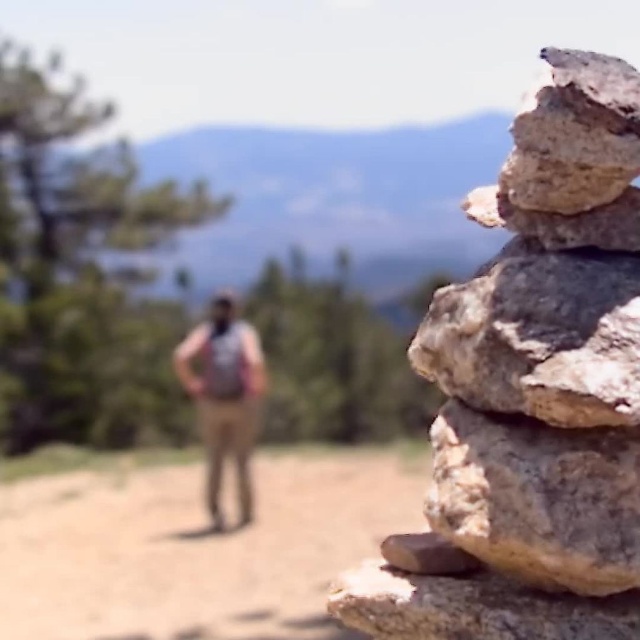
Who is positioned more to the left, green leafy pine at upper left or tan fabric pants at center?

green leafy pine at upper left is more to the left.

How much distance is there between green leafy pine at upper left and tan fabric pants at center?

green leafy pine at upper left and tan fabric pants at center are 7.55 inches apart.

Where is `green leafy pine at upper left`? green leafy pine at upper left is located at coordinates (81, 273).

Which of these two, rocky gray stone stack at right or green leafy pine at upper left, stands taller?

With more height is green leafy pine at upper left.

Describe the element at coordinates (532, 394) in the screenshot. Image resolution: width=640 pixels, height=640 pixels. I see `rocky gray stone stack at right` at that location.

You are a GUI agent. You are given a task and a screenshot of the screen. Output one action in this format:
    pyautogui.click(x=<x>, y=<y>)
    Task: Click on the rocky gray stone stack at right
    Image resolution: width=640 pixels, height=640 pixels.
    Given the screenshot: What is the action you would take?
    pos(532,394)

Is rocky gray stone stack at right further to the viewer compared to gray rough rock at right?

No, it is in front of gray rough rock at right.

Measure the distance between rocky gray stone stack at right and camera.

rocky gray stone stack at right is 4.09 feet from camera.

Locate an element on the screen. rocky gray stone stack at right is located at coordinates (532, 394).